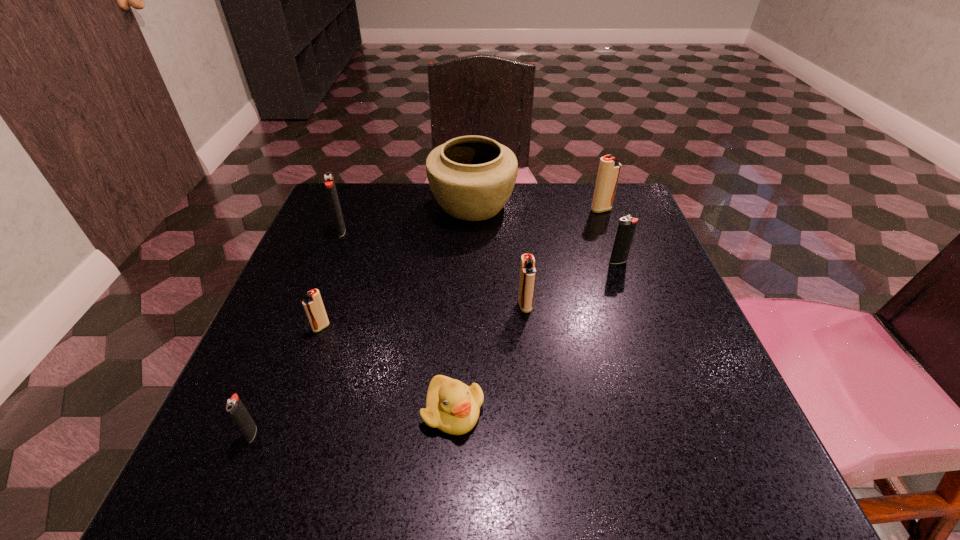
The width and height of the screenshot is (960, 540). I want to click on vacant region located on the left of the second nearest igniter, so click(260, 327).

At what (x,y) coordinates should I click in order to perform the action: click on free space located 0.070m on the back of the nearest igniter. Please return your answer as a coordinate pair (x, y). Looking at the image, I should click on (272, 386).

At what (x,y) coordinates should I click in order to perform the action: click on vacant region located on the beak of the shortest object. Please return your answer as a coordinate pair (x, y). This screenshot has height=540, width=960. Looking at the image, I should click on (449, 478).

Where is `pottery that is at the far edge`? The width and height of the screenshot is (960, 540). pottery that is at the far edge is located at coordinates (472, 177).

Identify the location of object that is positioned at the near edge. (235, 408).

Identify the location of object that is at the far left corner. (328, 177).

Locate an element on the screen. The image size is (960, 540). object located at the near left corner is located at coordinates (235, 408).

The image size is (960, 540). I want to click on object present at the far right corner, so click(x=609, y=168).

Find the location of a particular element. The height and width of the screenshot is (540, 960). vacant region at the far edge of the desktop is located at coordinates (494, 222).

This screenshot has height=540, width=960. I want to click on free region at the near edge of the desktop, so click(494, 489).